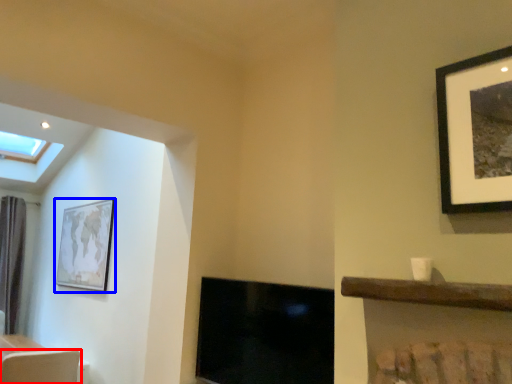
Question: Among these objects, which one is farthest to the camera, swivel chair (highlighted by a red box) or picture frame (highlighted by a blue box)?

Choices:
 (A) swivel chair
 (B) picture frame

Answer: (B)